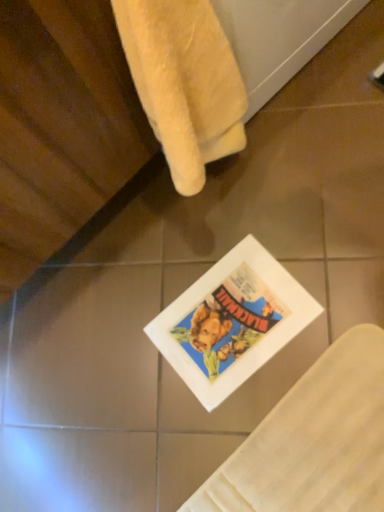
Question: From a real-world perspective, is soft yellow towel at upper left located beneath matte paper comic book at center?

Choices:
 (A) yes
 (B) no

Answer: (B)

Question: Considering the relative sizes of soft yellow towel at upper left and matte paper comic book at center in the image provided, is soft yellow towel at upper left thinner than matte paper comic book at center?

Choices:
 (A) yes
 (B) no

Answer: (A)

Question: Is soft yellow towel at upper left further to camera compared to matte paper comic book at center?

Choices:
 (A) yes
 (B) no

Answer: (B)

Question: Does soft yellow towel at upper left appear on the right side of matte paper comic book at center?

Choices:
 (A) yes
 (B) no

Answer: (B)

Question: Is soft yellow towel at upper left with matte paper comic book at center?

Choices:
 (A) no
 (B) yes

Answer: (A)

Question: Is soft yellow towel at upper left aimed at matte paper comic book at center?

Choices:
 (A) no
 (B) yes

Answer: (A)

Question: Can you confirm if matte paper comic book at center is smaller than soft yellow towel at upper left?

Choices:
 (A) yes
 (B) no

Answer: (A)

Question: Is matte paper comic book at center bigger than soft yellow towel at upper left?

Choices:
 (A) no
 (B) yes

Answer: (A)

Question: From a real-world perspective, is matte paper comic book at center physically below soft yellow towel at upper left?

Choices:
 (A) no
 (B) yes

Answer: (B)

Question: Is matte paper comic book at center far away from soft yellow towel at upper left?

Choices:
 (A) yes
 (B) no

Answer: (B)

Question: Is soft yellow towel at upper left at the back of matte paper comic book at center?

Choices:
 (A) yes
 (B) no

Answer: (B)

Question: Is matte paper comic book at center in front of soft yellow towel at upper left?

Choices:
 (A) yes
 (B) no

Answer: (B)

Question: Is point (228, 53) positioned closer to the camera than point (223, 301)?

Choices:
 (A) closer
 (B) farther

Answer: (A)